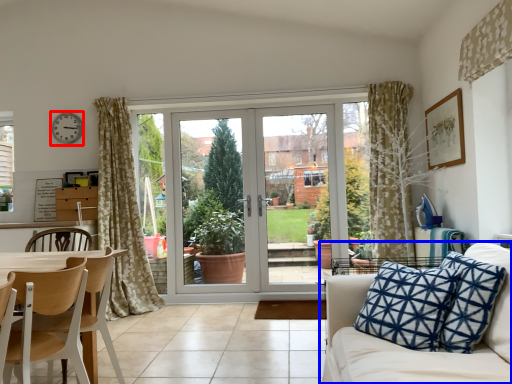
Question: Which object is closer to the camera taking this photo, clock (highlighted by a red box) or studio couch (highlighted by a blue box)?

Choices:
 (A) clock
 (B) studio couch

Answer: (B)